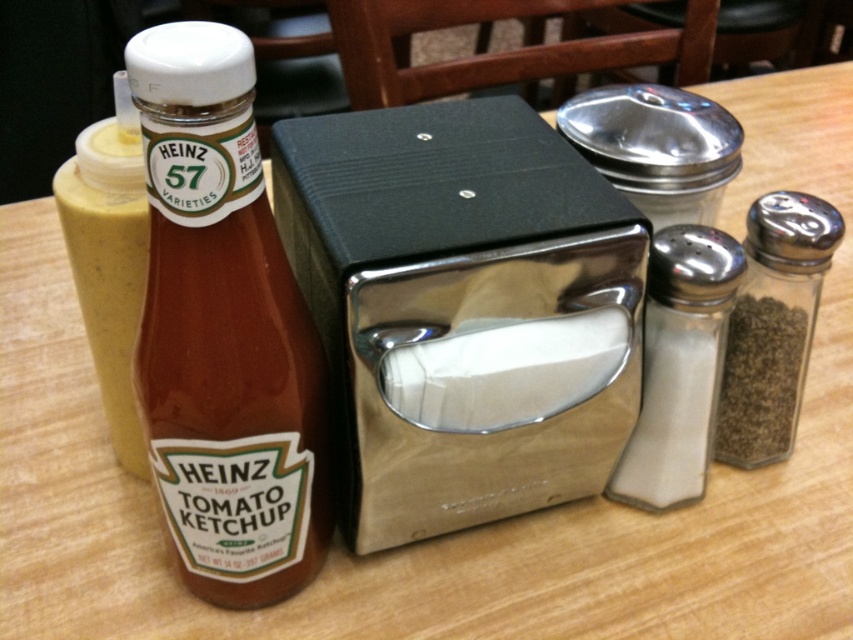
Is matte glass bottle at left to the right of clear glass salt shaker at right from the viewer's perspective?

No, matte glass bottle at left is not to the right of clear glass salt shaker at right.

Does matte glass bottle at left appear under clear glass salt shaker at right?

Indeed, matte glass bottle at left is positioned under clear glass salt shaker at right.

Does point (218, 163) lie behind point (729, 333)?

That is False.

This screenshot has height=640, width=853. Find the location of `matte glass bottle at left`. matte glass bottle at left is located at coordinates click(223, 332).

Which is in front, point (700, 372) or point (798, 304)?

Point (700, 372) is in front.

Where is `white glass salt shaker at right`? Image resolution: width=853 pixels, height=640 pixels. white glass salt shaker at right is located at coordinates (679, 365).

Can you confirm if matte glass bottle at left is bigger than white glass salt shaker at right?

Correct, matte glass bottle at left is larger in size than white glass salt shaker at right.

Based on the photo, measure the distance between matte glass bottle at left and camera.

matte glass bottle at left and camera are 12.19 inches apart from each other.

Between point (213, 145) and point (641, 426), which one is positioned in front?

Positioned in front is point (213, 145).

Where is `matte glass bottle at left`? matte glass bottle at left is located at coordinates [223, 332].